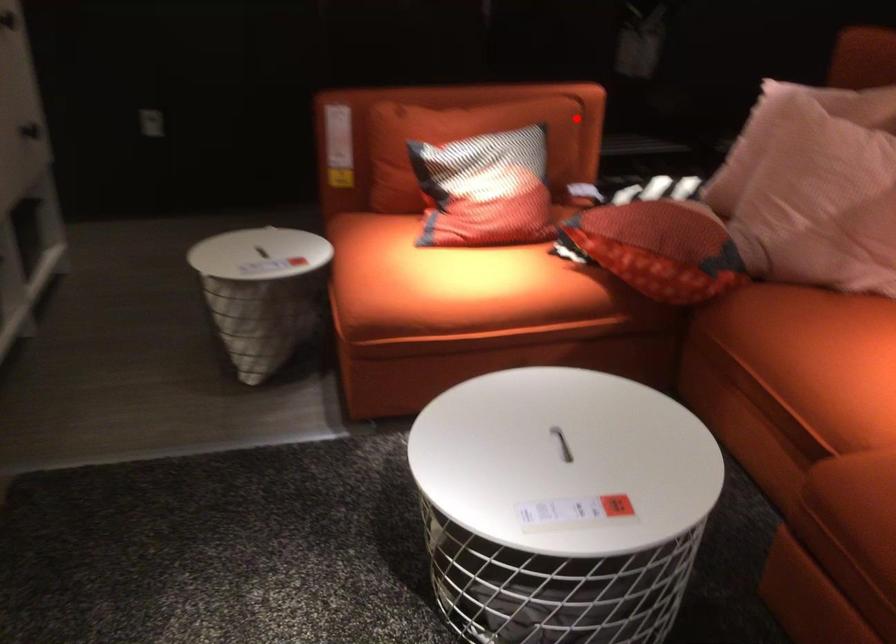
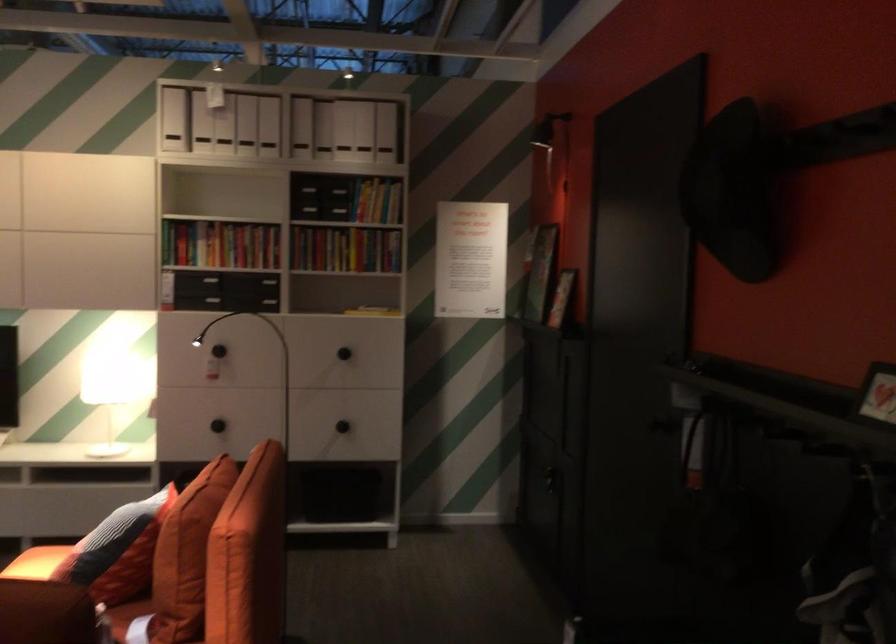
Where in the second image is the point corresponding to the highlighted location from the first image?

(186, 554)